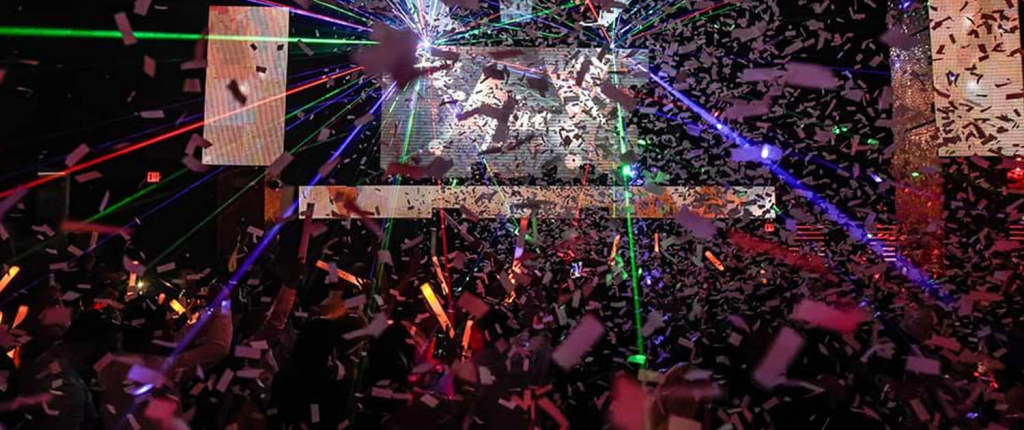
This screenshot has width=1024, height=430. In order to click on green light in this screenshot , I will do `click(191, 235)`.